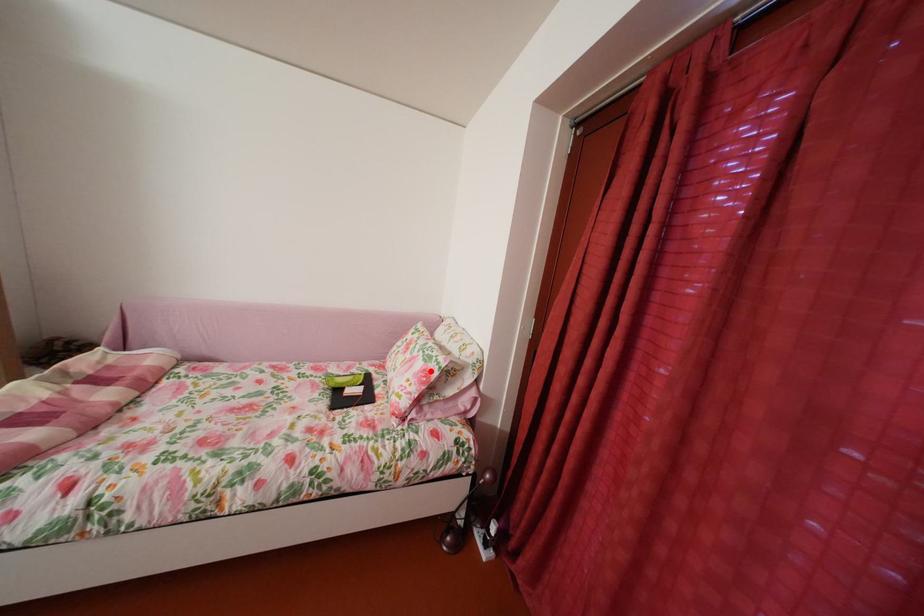
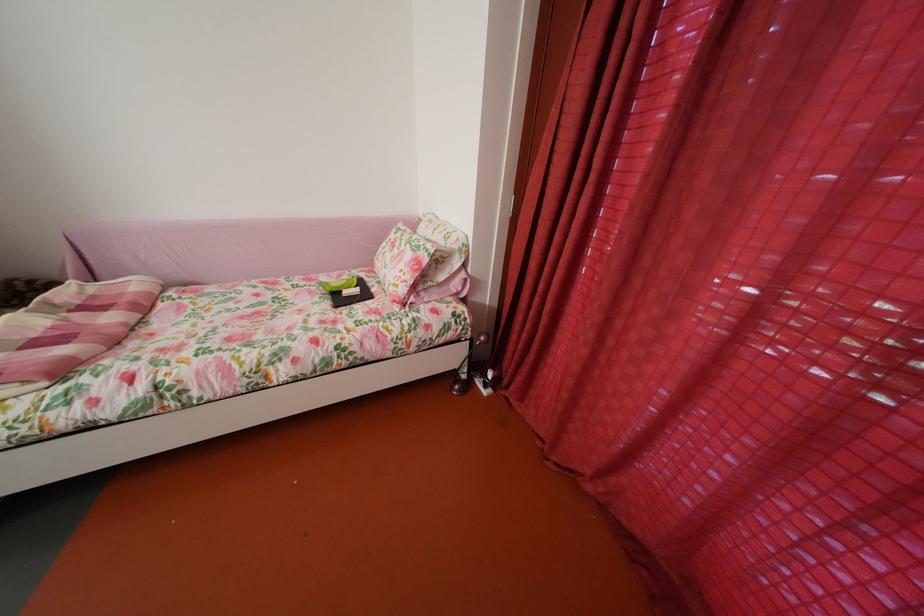
The point at the highlighted location is marked in the first image. Where is the corresponding point in the second image?

(419, 262)